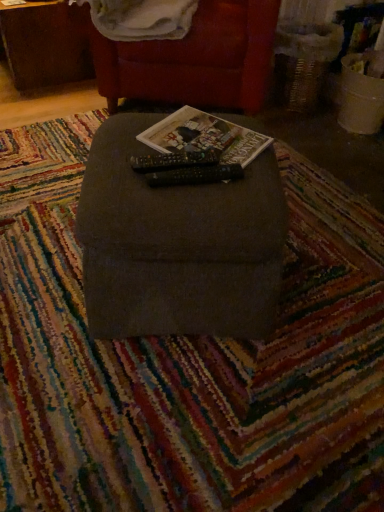
Describe the element at coordinates (195, 59) in the screenshot. I see `velvet red armchair at upper center, the 2th furniture from the front` at that location.

How much space does dark gray fabric ottoman at center, which appears as the second furniture when viewed from the back, occupy horizontally?

The width of dark gray fabric ottoman at center, which appears as the second furniture when viewed from the back, is 52.39 centimeters.

This screenshot has height=512, width=384. What do you see at coordinates (141, 18) in the screenshot?
I see `white soft blanket at upper center` at bounding box center [141, 18].

Measure the distance between point (204, 122) and camera.

Point (204, 122) is 3.75 feet from camera.

What are the coordinates of `velvet red armchair at upper center, the 2th furniture from the front` in the screenshot? It's located at (195, 59).

Based on their sizes in the image, would you say brown wood table at upper left is bigger or smaller than white soft blanket at upper center?

In the image, brown wood table at upper left appears to be larger than white soft blanket at upper center.

From a real-world perspective, is brown wood table at upper left positioned above or below white soft blanket at upper center?

From a real-world perspective, brown wood table at upper left is physically below white soft blanket at upper center.

Is brown wood table at upper left completely or partially outside of white soft blanket at upper center?

Yes, brown wood table at upper left is not within white soft blanket at upper center.

How different are the orientations of brown wood table at upper left and white soft blanket at upper center in degrees?

There is a 38.5-degree angle between the facing directions of brown wood table at upper left and white soft blanket at upper center.

From the image's perspective, which one is positioned lower, matte paper magazine at center or dark gray fabric ottoman at center, which appears as the second furniture when viewed from the back?

From the image's view, dark gray fabric ottoman at center, which appears as the second furniture when viewed from the back, is below.

Which of these two, matte paper magazine at center or dark gray fabric ottoman at center, the first furniture in the bottom-to-top sequence, is thinner?

matte paper magazine at center is thinner.

Identify the location of magazine that appears behind the dark gray fabric ottoman at center, which appears as the second furniture when viewed from the back. The image size is (384, 512). (204, 137).

Does matte paper magazine at center have a lesser height compared to dark gray fabric ottoman at center, the first furniture in the bottom-to-top sequence?

Indeed, matte paper magazine at center has a lesser height compared to dark gray fabric ottoman at center, the first furniture in the bottom-to-top sequence.

From a real-world perspective, between velvet red armchair at upper center, the 2th furniture from the front, and dark gray fabric ottoman at center, the first furniture positioned from the front, who is vertically higher?

velvet red armchair at upper center, the 2th furniture from the front, from a real-world perspective.

Measure the distance from velvet red armchair at upper center, which appears as the 1th furniture when viewed from the back, to dark gray fabric ottoman at center, which appears as the second furniture when viewed from the back.

They are 36.78 inches apart.

What's the angular difference between velvet red armchair at upper center, arranged as the second furniture when ordered from the bottom, and dark gray fabric ottoman at center, placed as the 2th furniture when sorted from top to bottom,'s facing directions?

81.9 degrees separate the facing orientations of velvet red armchair at upper center, arranged as the second furniture when ordered from the bottom, and dark gray fabric ottoman at center, placed as the 2th furniture when sorted from top to bottom.

Does velvet red armchair at upper center, arranged as the second furniture when ordered from the bottom, have a lesser height compared to dark gray fabric ottoman at center, the first furniture positioned from the front?

Incorrect, the height of velvet red armchair at upper center, arranged as the second furniture when ordered from the bottom, does not fall short of that of dark gray fabric ottoman at center, the first furniture positioned from the front.

Is dark gray fabric ottoman at center, the first furniture in the bottom-to-top sequence, oriented towards white soft blanket at upper center?

No, dark gray fabric ottoman at center, the first furniture in the bottom-to-top sequence, is not facing towards white soft blanket at upper center.

Is the position of dark gray fabric ottoman at center, which appears as the second furniture when viewed from the back, more distant than that of white soft blanket at upper center?

No, the depth of dark gray fabric ottoman at center, which appears as the second furniture when viewed from the back, is less than that of white soft blanket at upper center.

How many degrees apart are the facing directions of dark gray fabric ottoman at center, placed as the 2th furniture when sorted from top to bottom, and white soft blanket at upper center?

The facing directions of dark gray fabric ottoman at center, placed as the 2th furniture when sorted from top to bottom, and white soft blanket at upper center are 79.2 degrees apart.

From a real-world perspective, which object stands above the other?

white soft blanket at upper center, from a real-world perspective.

Could you tell me if dark gray fabric ottoman at center, which appears as the second furniture when viewed from the back, is facing velvet red armchair at upper center, which appears as the 1th furniture when viewed from the back?

No, dark gray fabric ottoman at center, which appears as the second furniture when viewed from the back, is not aimed at velvet red armchair at upper center, which appears as the 1th furniture when viewed from the back.

How far apart are dark gray fabric ottoman at center, the first furniture positioned from the front, and velvet red armchair at upper center, the 1th furniture viewed from the top?

The distance of dark gray fabric ottoman at center, the first furniture positioned from the front, from velvet red armchair at upper center, the 1th furniture viewed from the top, is 36.78 inches.

Who is bigger, dark gray fabric ottoman at center, the first furniture positioned from the front, or velvet red armchair at upper center, which appears as the 1th furniture when viewed from the back?

velvet red armchair at upper center, which appears as the 1th furniture when viewed from the back, is bigger.

How different are the orientations of dark gray fabric ottoman at center, placed as the 2th furniture when sorted from top to bottom, and velvet red armchair at upper center, the 2th furniture from the front, in degrees?

The angle between the facing direction of dark gray fabric ottoman at center, placed as the 2th furniture when sorted from top to bottom, and the facing direction of velvet red armchair at upper center, the 2th furniture from the front, is 81.9 degrees.

Do you think white soft blanket at upper center is within velvet red armchair at upper center, arranged as the second furniture when ordered from the bottom, or outside of it?

white soft blanket at upper center can be found inside velvet red armchair at upper center, arranged as the second furniture when ordered from the bottom.

From the image's perspective, is white soft blanket at upper center over velvet red armchair at upper center, the 2th furniture from the front?

Actually, white soft blanket at upper center appears below velvet red armchair at upper center, the 2th furniture from the front, in the image.

In terms of height, does white soft blanket at upper center look taller or shorter compared to velvet red armchair at upper center, arranged as the second furniture when ordered from the bottom?

white soft blanket at upper center is shorter than velvet red armchair at upper center, arranged as the second furniture when ordered from the bottom.

Identify the location of the 2nd furniture to the right when counting from the white soft blanket at upper center. (195, 59).

Are dark gray fabric ottoman at center, which appears as the second furniture when viewed from the back, and brown wood table at upper left located far from each other?

dark gray fabric ottoman at center, which appears as the second furniture when viewed from the back, is positioned a significant distance from brown wood table at upper left.

Which object is wider, dark gray fabric ottoman at center, the first furniture in the bottom-to-top sequence, or brown wood table at upper left?

brown wood table at upper left is wider.

From a real-world perspective, who is located lower, dark gray fabric ottoman at center, placed as the 2th furniture when sorted from top to bottom, or brown wood table at upper left?

brown wood table at upper left, from a real-world perspective.

Would you say brown wood table at upper left is part of dark gray fabric ottoman at center, the first furniture in the bottom-to-top sequence,'s contents?

No, dark gray fabric ottoman at center, the first furniture in the bottom-to-top sequence, does not contain brown wood table at upper left.

Find the location of `table above the white soft blanket at upper center (from the image's perspective)`. table above the white soft blanket at upper center (from the image's perspective) is located at coordinates (46, 44).

Locate an element on the screen. The height and width of the screenshot is (512, 384). furniture that is the 2nd one when counting leftward from the matte paper magazine at center is located at coordinates (177, 245).

Which object lies nearer to the anchor point matte paper magazine at center, brown wood table at upper left or velvet red armchair at upper center, which appears as the 1th furniture when viewed from the back?

velvet red armchair at upper center, which appears as the 1th furniture when viewed from the back, is positioned closer to the anchor matte paper magazine at center.

Which object lies further to the anchor point brown wood table at upper left, matte paper magazine at center or velvet red armchair at upper center, which appears as the 1th furniture when viewed from the back?

Among the two, matte paper magazine at center is located further to brown wood table at upper left.

From the picture: Considering their positions, is dark gray fabric ottoman at center, placed as the 2th furniture when sorted from top to bottom, positioned further to white soft blanket at upper center than velvet red armchair at upper center, the 1th furniture viewed from the top?

The object further to white soft blanket at upper center is dark gray fabric ottoman at center, placed as the 2th furniture when sorted from top to bottom.

Estimate the real-world distances between objects in this image. Which object is closer to white soft blanket at upper center, velvet red armchair at upper center, the 2th furniture from the front, or brown wood table at upper left?

velvet red armchair at upper center, the 2th furniture from the front.

Estimate the real-world distances between objects in this image. Which object is closer to matte paper magazine at center, white soft blanket at upper center or dark gray fabric ottoman at center, the first furniture in the bottom-to-top sequence?

dark gray fabric ottoman at center, the first furniture in the bottom-to-top sequence.

Considering their positions, is velvet red armchair at upper center, which appears as the 1th furniture when viewed from the back, positioned further to brown wood table at upper left than matte paper magazine at center?

Based on the image, matte paper magazine at center appears to be further to brown wood table at upper left.

Estimate the real-world distances between objects in this image. Which object is closer to velvet red armchair at upper center, which appears as the 1th furniture when viewed from the back, brown wood table at upper left or matte paper magazine at center?

brown wood table at upper left is closer to velvet red armchair at upper center, which appears as the 1th furniture when viewed from the back.

Estimate the real-world distances between objects in this image. Which object is further from matte paper magazine at center, white soft blanket at upper center or velvet red armchair at upper center, arranged as the second furniture when ordered from the bottom?

The object further to matte paper magazine at center is white soft blanket at upper center.

Find the location of a particular element. The height and width of the screenshot is (512, 384). magazine between velvet red armchair at upper center, arranged as the second furniture when ordered from the bottom, and dark gray fabric ottoman at center, the first furniture in the bottom-to-top sequence, in the up-down direction is located at coordinates (204, 137).

This screenshot has height=512, width=384. Find the location of `furniture that lies between brown wood table at upper left and matte paper magazine at center from top to bottom`. furniture that lies between brown wood table at upper left and matte paper magazine at center from top to bottom is located at coordinates (195, 59).

Find the location of a particular element. The height and width of the screenshot is (512, 384). blanket between velvet red armchair at upper center, the 1th furniture viewed from the top, and dark gray fabric ottoman at center, the first furniture in the bottom-to-top sequence, in the up-down direction is located at coordinates (141, 18).

Image resolution: width=384 pixels, height=512 pixels. In order to click on blanket between brown wood table at upper left and velvet red armchair at upper center, arranged as the second furniture when ordered from the bottom, in the horizontal direction in this screenshot , I will do `click(141, 18)`.